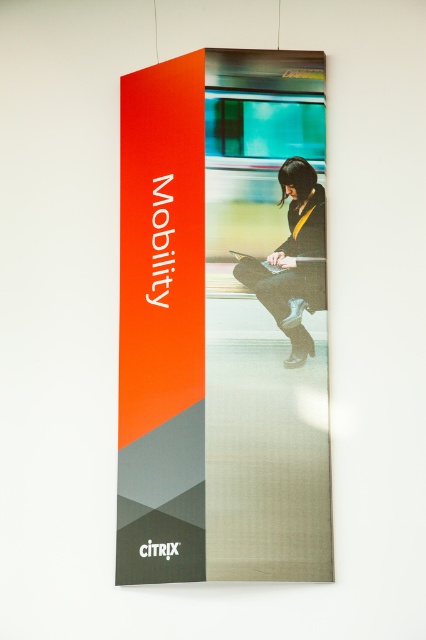
Question: From the image, what is the correct spatial relationship of orange matte poster at center in relation to black leather jacket at center?

Choices:
 (A) above
 (B) below

Answer: (B)

Question: Is orange matte poster at center bigger than black leather jacket at center?

Choices:
 (A) yes
 (B) no

Answer: (A)

Question: Which of the following is the farthest from the observer?

Choices:
 (A) (296, 168)
 (B) (132, 316)

Answer: (A)

Question: Does orange matte poster at center have a greater width compared to black leather jacket at center?

Choices:
 (A) no
 (B) yes

Answer: (B)